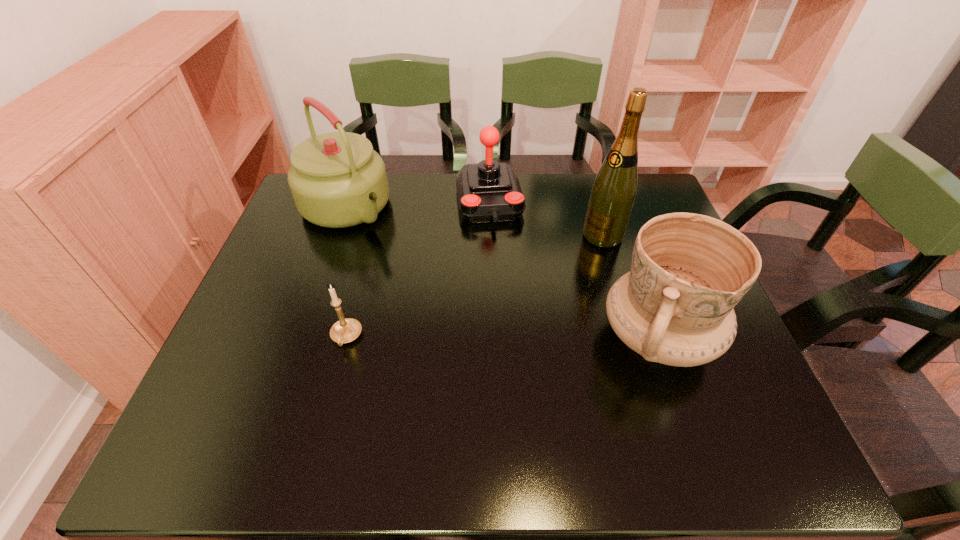
Where is `object positioned at the left edge`? object positioned at the left edge is located at coordinates (337, 180).

Where is `pottery that is at the right edge`? pottery that is at the right edge is located at coordinates (688, 271).

At what (x,y) coordinates should I click in order to perform the action: click on wine bottle that is positioned at the right edge. Please return your answer as a coordinate pair (x, y). This screenshot has width=960, height=540. Looking at the image, I should click on (613, 193).

The height and width of the screenshot is (540, 960). Find the location of `object that is at the far left corner`. object that is at the far left corner is located at coordinates (337, 180).

This screenshot has width=960, height=540. I want to click on object that is at the near right corner, so click(688, 271).

This screenshot has width=960, height=540. Identify the location of free location at the far edge of the desktop. (403, 212).

In the image, there is a desktop. Identify the location of vacant space at the near edge. (478, 411).

The width and height of the screenshot is (960, 540). Identify the location of blank space at the left edge of the desktop. (287, 240).

This screenshot has height=540, width=960. I want to click on vacant space at the right edge of the desktop, so click(724, 373).

Where is `blank space at the far right corner of the desktop`? blank space at the far right corner of the desktop is located at coordinates (644, 202).